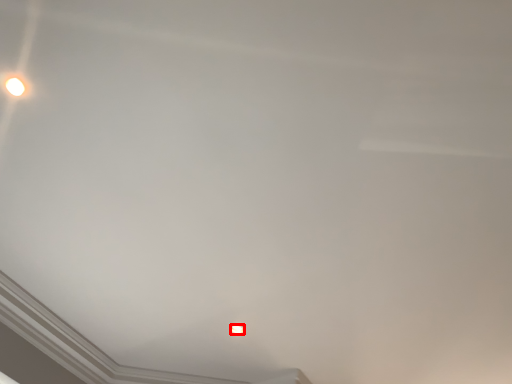
Question: Considering the relative positions of lamp (annotated by the red box) and lamp in the image provided, where is lamp (annotated by the red box) located with respect to the staircase?

Choices:
 (A) left
 (B) right

Answer: (B)